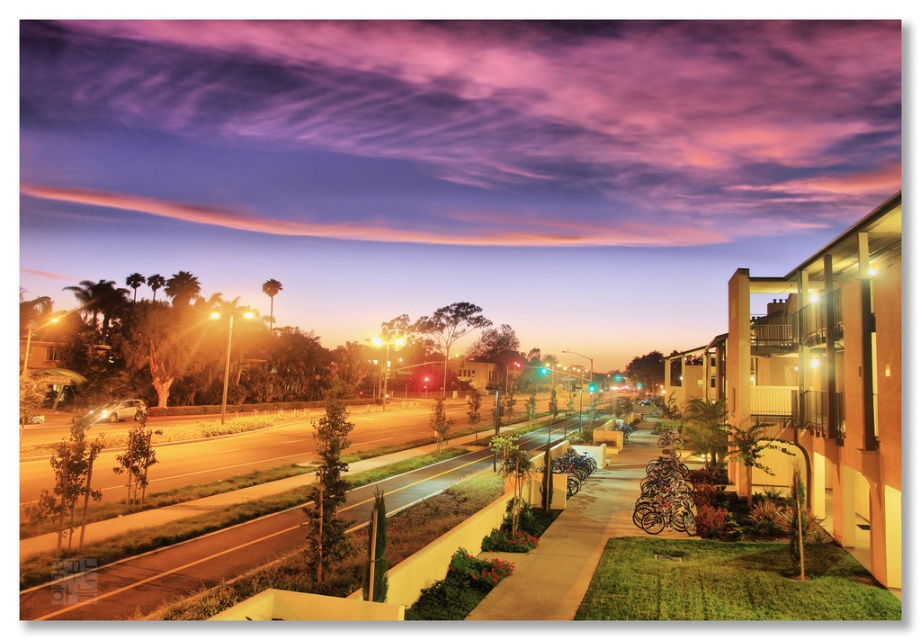
Is purple cloud at upper center further to the viewer compared to concrete sidewalk at center?

That is True.

Who is positioned more to the right, purple cloud at upper center or concrete sidewalk at center?

From the viewer's perspective, concrete sidewalk at center appears more on the right side.

Between point (388, 134) and point (539, 609), which one is positioned behind?

The point (388, 134) is behind.

Find the location of a particular element. purple cloud at upper center is located at coordinates (465, 125).

Is point (654, 76) positioned behind point (440, 528)?

Yes, point (654, 76) is farther from viewer.

Who is more distant from viewer, (61, 132) or (192, 588)?

Positioned behind is point (61, 132).

Image resolution: width=921 pixels, height=640 pixels. Describe the element at coordinates (465, 125) in the screenshot. I see `purple cloud at upper center` at that location.

The image size is (921, 640). I want to click on purple cloud at upper center, so pyautogui.click(x=465, y=125).

Image resolution: width=921 pixels, height=640 pixels. I want to click on smooth asphalt road at center, so click(172, 570).

Which is more to the right, smooth asphalt road at center or concrete sidewalk at center?

From the viewer's perspective, concrete sidewalk at center appears more on the right side.

You are a GUI agent. You are given a task and a screenshot of the screen. Output one action in this format:
    pyautogui.click(x=<x>, y=<y>)
    Task: Click on the smooth asphalt road at center
    The image size is (921, 640).
    Given the screenshot: What is the action you would take?
    pyautogui.click(x=172, y=570)